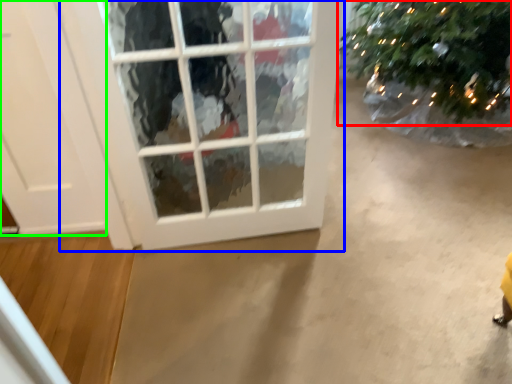
Question: Considering the real-world distances, which object is farthest from christmas tree (highlighted by a red box)? window (highlighted by a blue box) or door (highlighted by a green box)?

Choices:
 (A) window
 (B) door

Answer: (B)